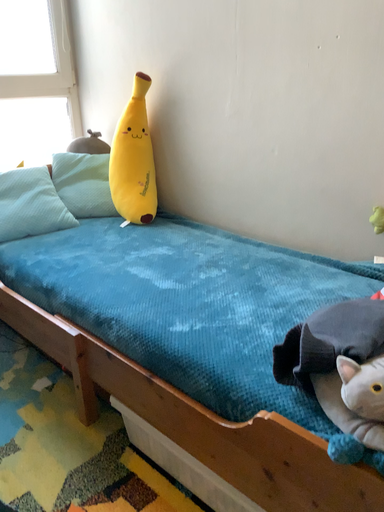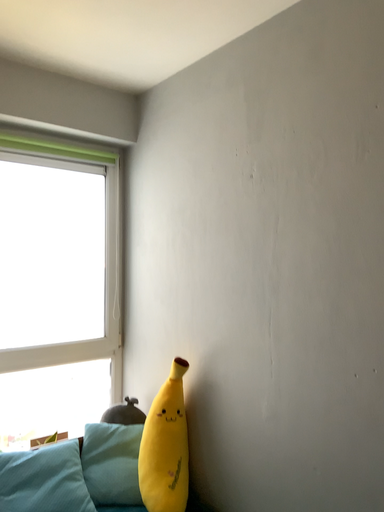
Question: Which way did the camera rotate in the video?

Choices:
 (A) rotated upward
 (B) rotated downward

Answer: (A)